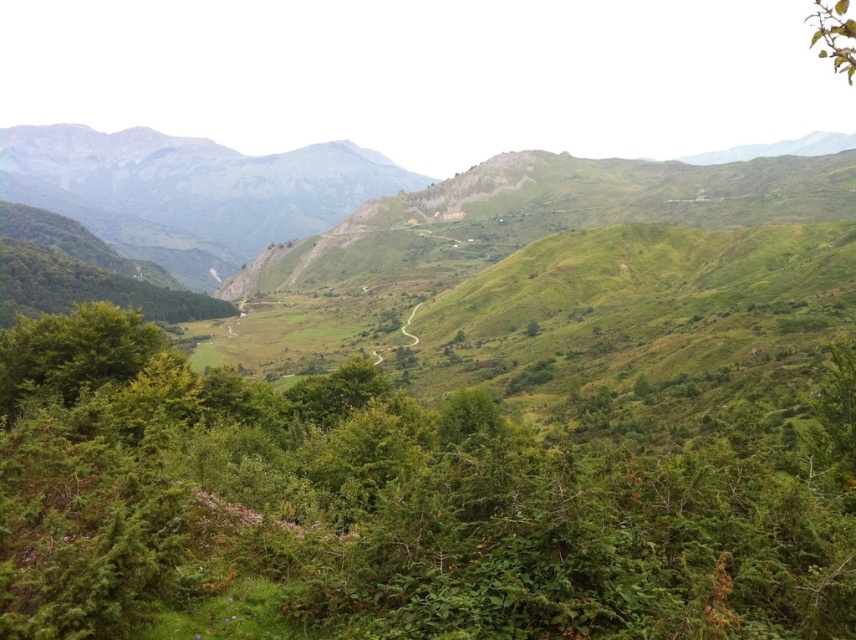
Which of these two, green leafy shrub at center or green leafy branch at upper right, stands shorter?

Standing shorter between the two is green leafy shrub at center.

Which of these two, green leafy shrub at center or green leafy branch at upper right, stands taller?

green leafy branch at upper right is taller.

Is point (756, 432) farther from viewer compared to point (849, 20)?

Yes, point (756, 432) is behind point (849, 20).

Where is `green leafy shrub at center`? Image resolution: width=856 pixels, height=640 pixels. green leafy shrub at center is located at coordinates (391, 504).